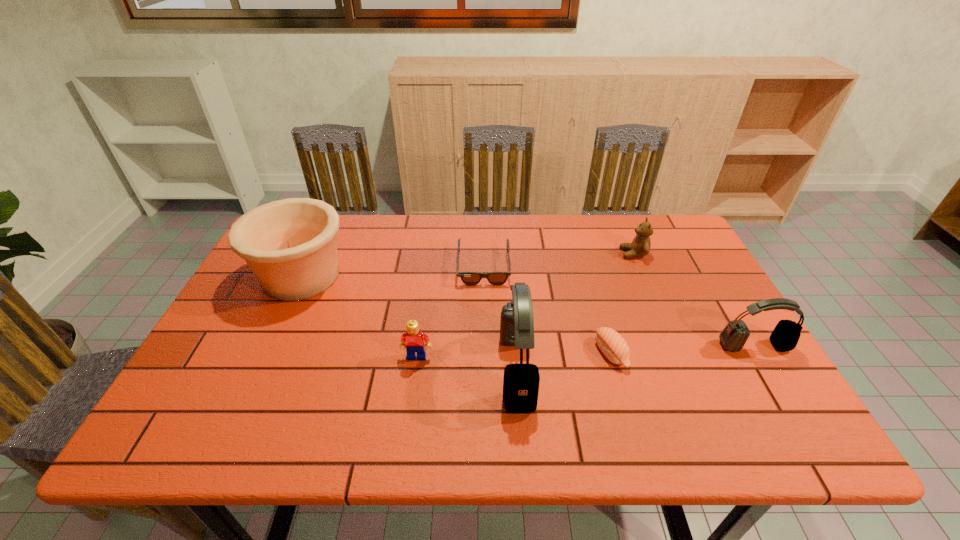
Locate an element on the screen. The image size is (960, 540). free space located 0.210m on the back of the sushi is located at coordinates (589, 280).

The image size is (960, 540). In order to click on free spot located 0.050m on the front-facing side of the second object from left to right in this screenshot , I will do `click(414, 379)`.

Where is `teddy bear situated at the far edge`? Image resolution: width=960 pixels, height=540 pixels. teddy bear situated at the far edge is located at coordinates (640, 246).

Identify the location of pottery at the far edge. The width and height of the screenshot is (960, 540). [x=290, y=245].

Identify the location of sunglasses positioned at the far edge. (469, 278).

Locate an element on the screen. This screenshot has width=960, height=540. object that is at the near edge is located at coordinates (521, 381).

I want to click on object at the left edge, so click(x=290, y=245).

This screenshot has width=960, height=540. I want to click on headset that is at the right edge, so click(785, 336).

At what (x,y) coordinates should I click in order to perform the action: click on teddy bear that is at the right edge. Please return your answer as a coordinate pair (x, y). Image resolution: width=960 pixels, height=540 pixels. Looking at the image, I should click on (640, 246).

Identify the location of object that is at the far left corner. (290, 245).